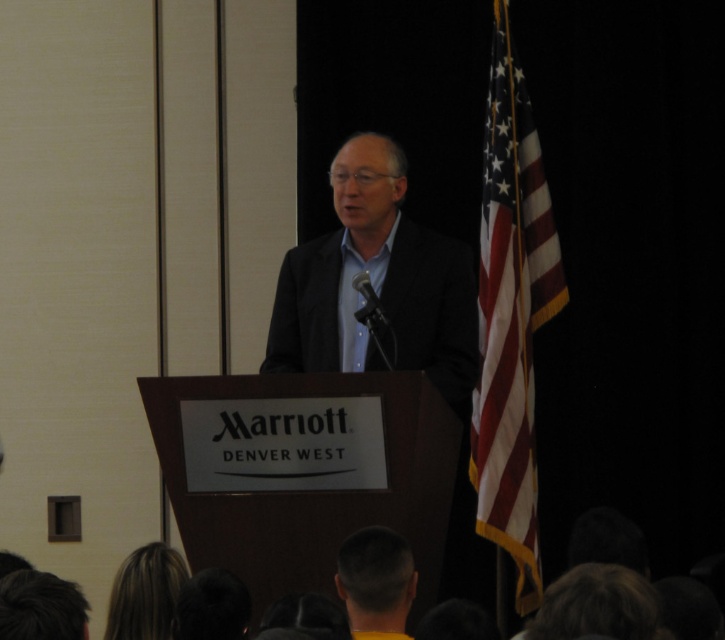
In the scene shown: Does american flag at right have a greater width compared to dark brown hair at lower center?

Yes.

Between point (526, 492) and point (405, 604), which one is positioned in front?

Positioned in front is point (405, 604).

Where is `american flag at right`? american flag at right is located at coordinates (510, 316).

Which of these two, american flag at right or dark brown hair at lower left, stands shorter?

dark brown hair at lower left

Does american flag at right have a larger size compared to dark brown hair at lower left?

Yes.

Which is behind, point (481, 449) or point (62, 620)?

Point (481, 449)

At what (x,y) coordinates should I click in order to perform the action: click on american flag at right. Please return your answer as a coordinate pair (x, y). This screenshot has height=640, width=725. Looking at the image, I should click on (510, 316).

Is dark brown hair at lower right further to camera compared to dark brown hair at lower center?

No, dark brown hair at lower right is closer to the viewer.

Can you confirm if dark brown hair at lower right is taller than dark brown hair at lower center?

No.

Identify the location of dark brown hair at lower right. (596, 605).